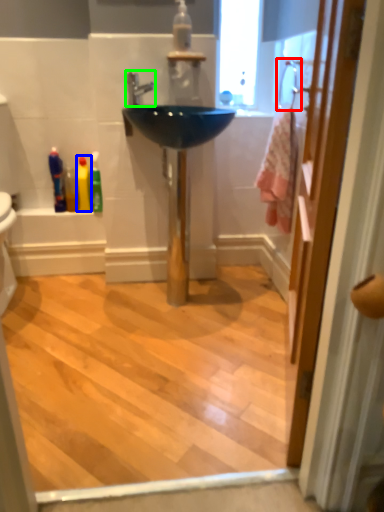
Question: Which object is positioned farthest from shower (highlighted by a red box)? Select from toiletry (highlighted by a blue box) and tap (highlighted by a green box).

Choices:
 (A) toiletry
 (B) tap

Answer: (A)